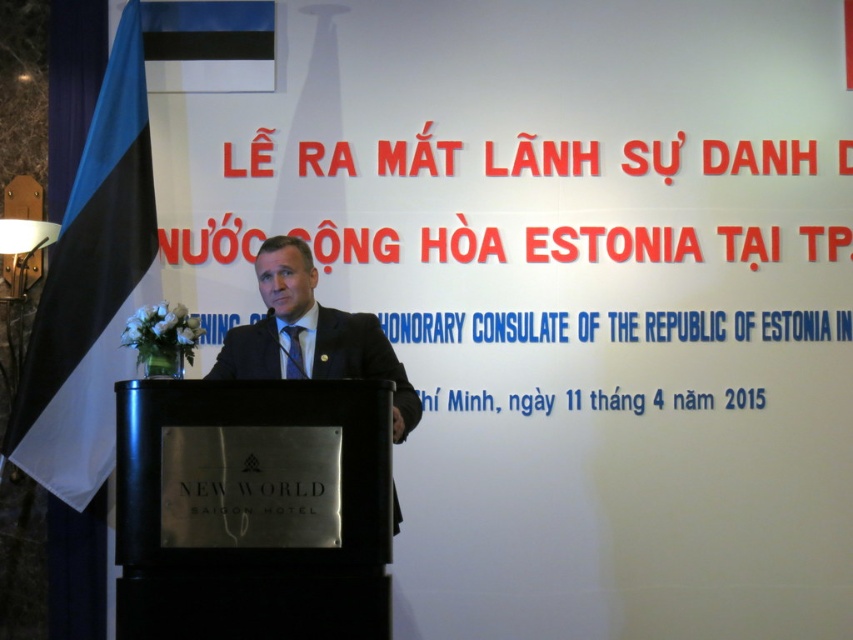
You are attending the event at the New World Saigon Hotel and need to locate the podium. According to the image, where exactly is the black polished wood podium at center positioned?

The black polished wood podium at center is positioned at point (252,509).

In the scene shown: As a guest at the event, you are standing at the entrance of the New World Saigon Hotel and see two points marked on the stage. The first point is at coordinates point(x=292, y=474) and the second is at point(x=407, y=404). Which point is closer to you?

Point(x=292, y=474) is in front of point(x=407, y=404), so it is closer to you.